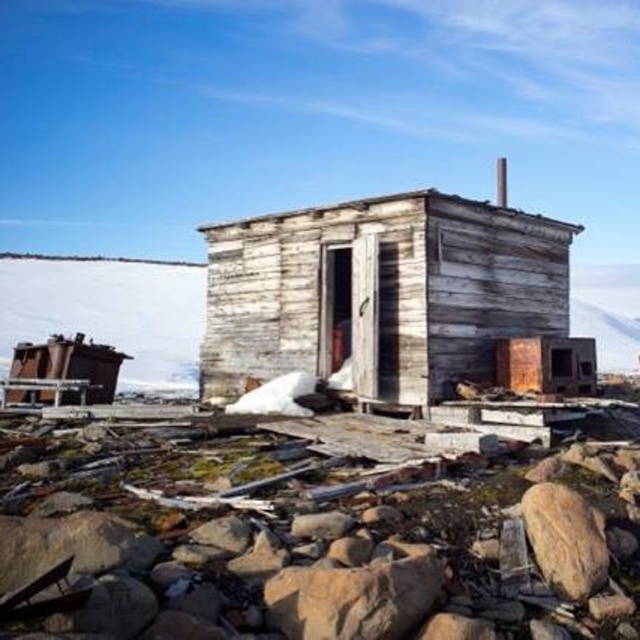
Describe the element at coordinates (381, 292) in the screenshot. I see `weathered wood hut at center` at that location.

Can you confirm if weathered wood hut at center is positioned below brown rough rock at lower right?

No, weathered wood hut at center is not below brown rough rock at lower right.

This screenshot has height=640, width=640. Describe the element at coordinates (381, 292) in the screenshot. I see `weathered wood hut at center` at that location.

Locate an element on the screen. Image resolution: width=640 pixels, height=640 pixels. weathered wood hut at center is located at coordinates (381, 292).

Does weathered wood hut at center appear on the left side of brown rough rock at lower center?

Yes, weathered wood hut at center is to the left of brown rough rock at lower center.

Based on the photo, can you confirm if weathered wood hut at center is thinner than brown rough rock at lower center?

In fact, weathered wood hut at center might be wider than brown rough rock at lower center.

Looking at this image, who is more distant from viewer, (x=288, y=272) or (x=381, y=596)?

The point (x=288, y=272) is more distant.

Find the location of a particular element. weathered wood hut at center is located at coordinates (381, 292).

Is brown rough rock at lower center positioned before brown rough rock at lower right?

Yes, brown rough rock at lower center is closer to the viewer.

How much distance is there between brown rough rock at lower center and brown rough rock at lower right?

A distance of 1.91 meters exists between brown rough rock at lower center and brown rough rock at lower right.

This screenshot has height=640, width=640. I want to click on brown rough rock at lower center, so click(353, 598).

Identify the location of brown rough rock at lower center. (353, 598).